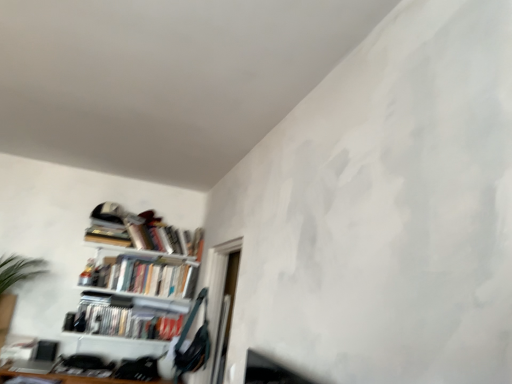
Question: Considering the relative positions of hardcover books at upper left, which appears as the first book when viewed from the top, and white glossy bookshelf at lower left, which is the 3th book in top-to-bottom order, in the image provided, is hardcover books at upper left, which appears as the first book when viewed from the top, to the right of white glossy bookshelf at lower left, which is the 3th book in top-to-bottom order, from the viewer's perspective?

Choices:
 (A) yes
 (B) no

Answer: (A)

Question: Does hardcover books at upper left, which appears as the first book when viewed from the top, have a smaller size compared to white glossy bookshelf at lower left, which is counted as the first book, starting from the bottom?

Choices:
 (A) yes
 (B) no

Answer: (B)

Question: Is white glossy bookshelf at lower left, which is the 3th book in top-to-bottom order, inside hardcover books at upper left, which is the 3th book in bottom-to-top order?

Choices:
 (A) yes
 (B) no

Answer: (B)

Question: From a real-world perspective, is hardcover books at upper left, which appears as the first book when viewed from the top, located beneath white glossy bookshelf at lower left, which is counted as the first book, starting from the bottom?

Choices:
 (A) no
 (B) yes

Answer: (A)

Question: Is hardcover books at upper left, which appears as the first book when viewed from the top, next to white glossy bookshelf at lower left, which is counted as the first book, starting from the bottom, and touching it?

Choices:
 (A) no
 (B) yes

Answer: (A)

Question: From the image's perspective, relative to hardcover books at upper left, the second book when ordered from top to bottom, is transparent glass door at center above or below?

Choices:
 (A) above
 (B) below

Answer: (B)

Question: Considering the positions of transparent glass door at center and hardcover books at upper left, which is counted as the second book, starting from the bottom, in the image, is transparent glass door at center wider or thinner than hardcover books at upper left, which is counted as the second book, starting from the bottom,?

Choices:
 (A) thin
 (B) wide

Answer: (A)

Question: In terms of height, does transparent glass door at center look taller or shorter compared to hardcover books at upper left, which is counted as the second book, starting from the bottom?

Choices:
 (A) tall
 (B) short

Answer: (A)

Question: Is point (214, 258) closer or farther from the camera than point (100, 286)?

Choices:
 (A) closer
 (B) farther

Answer: (A)

Question: Looking at their shapes, would you say hardcover books at upper left, which is counted as the second book, starting from the bottom, is wider or thinner than transparent glass door at center?

Choices:
 (A) thin
 (B) wide

Answer: (B)

Question: Is point (144, 284) closer or farther from the camera than point (207, 304)?

Choices:
 (A) farther
 (B) closer

Answer: (A)

Question: Considering their positions, is hardcover books at upper left, which is counted as the second book, starting from the bottom, located in front of or behind transparent glass door at center?

Choices:
 (A) behind
 (B) front

Answer: (A)

Question: Is hardcover books at upper left, the second book when ordered from top to bottom, situated inside transparent glass door at center or outside?

Choices:
 (A) inside
 (B) outside

Answer: (B)

Question: From a real-world perspective, is hardcover books at upper left, which appears as the first book when viewed from the top, above or below white glossy bookshelf at lower left, which is counted as the first book, starting from the bottom?

Choices:
 (A) above
 (B) below

Answer: (A)

Question: In terms of height, does hardcover books at upper left, which appears as the first book when viewed from the top, look taller or shorter compared to white glossy bookshelf at lower left, which is counted as the first book, starting from the bottom?

Choices:
 (A) short
 (B) tall

Answer: (B)